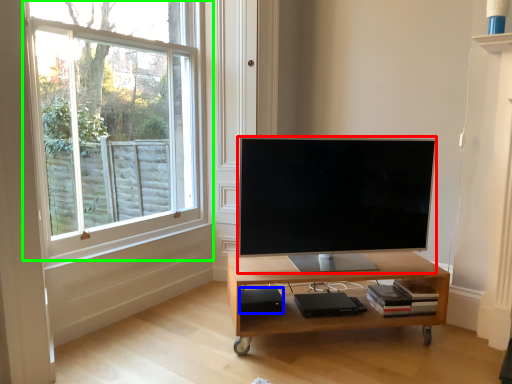
Question: Estimate the real-world distances between objects in this image. Which object is closer to television (highlighted by a red box), speaker (highlighted by a blue box) or window (highlighted by a green box)?

Choices:
 (A) speaker
 (B) window

Answer: (A)